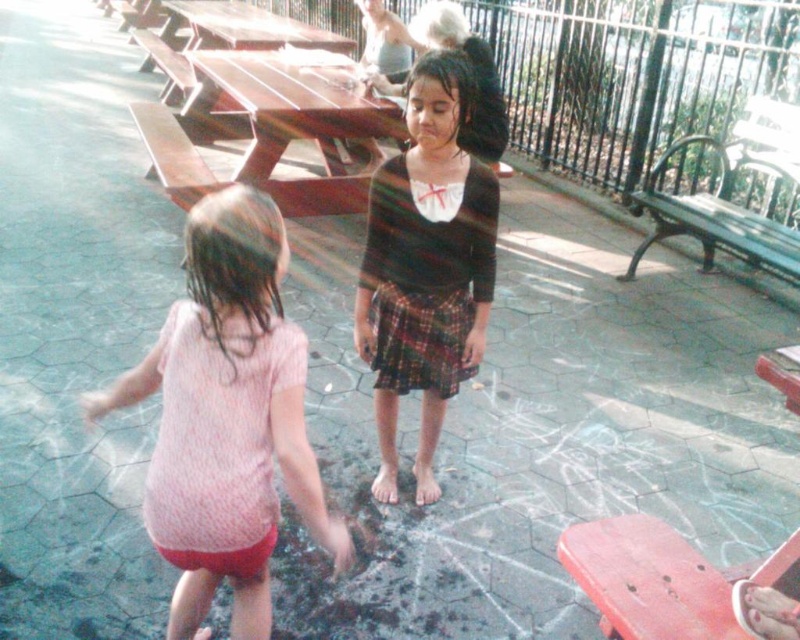
Between pink fabric shirt at center and brown wooden picnic table at center, which one is positioned lower?

pink fabric shirt at center is lower down.

Does pink fabric shirt at center have a lesser height compared to brown wooden picnic table at center?

Yes.

Is point (141, 365) more distant than point (354, 125)?

No.

Find the location of a particular element. The width and height of the screenshot is (800, 640). pink fabric shirt at center is located at coordinates (226, 417).

Which is more to the left, pink fabric shirt at center or striped knit sweater at center?

pink fabric shirt at center is more to the left.

How distant is pink fabric shirt at center from striped knit sweater at center?

pink fabric shirt at center is 31.59 inches from striped knit sweater at center.

You are a GUI agent. You are given a task and a screenshot of the screen. Output one action in this format:
    pyautogui.click(x=<x>, y=<y>)
    Task: Click on the pink fabric shirt at center
    
    Given the screenshot: What is the action you would take?
    pyautogui.click(x=226, y=417)

Does point (362, 275) come behind point (244, 81)?

No, (362, 275) is in front of (244, 81).

The height and width of the screenshot is (640, 800). Find the location of `striped knit sweater at center`. striped knit sweater at center is located at coordinates (426, 266).

At what (x,y) coordinates should I click in order to perform the action: click on striped knit sweater at center. Please return your answer as a coordinate pair (x, y). The width and height of the screenshot is (800, 640). Looking at the image, I should click on (426, 266).